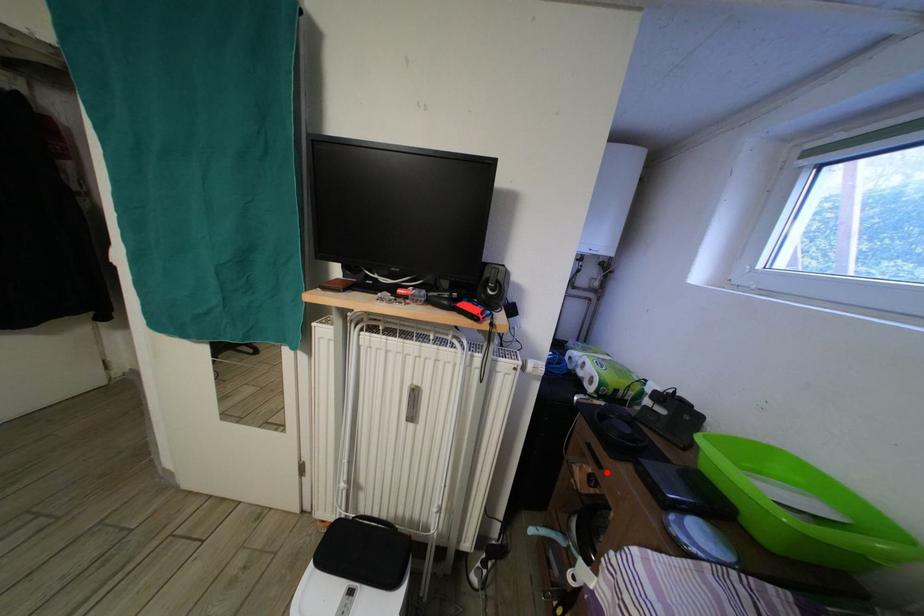
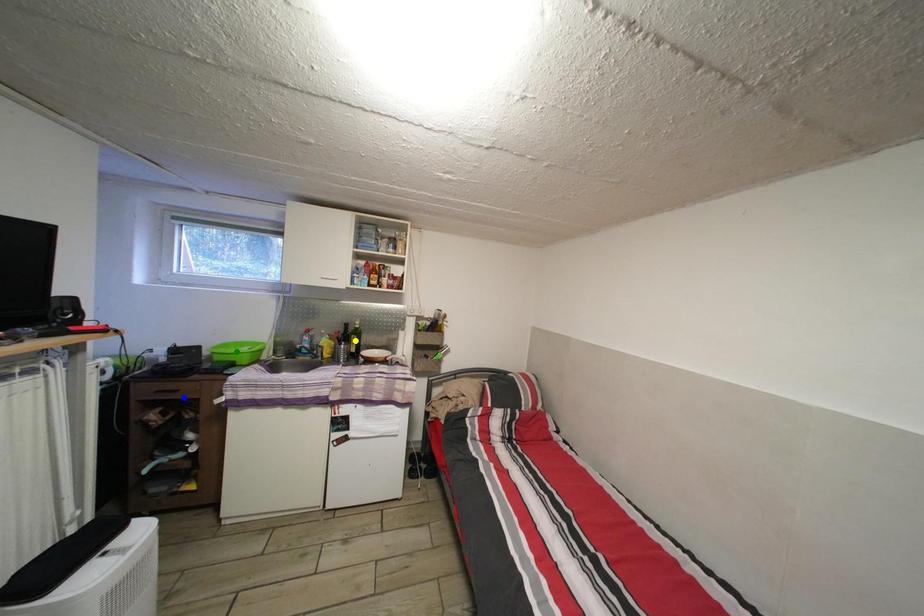
Question: I am providing you with two images of the same scene from different viewpoints. A red point is marked on the first image. You are given multiple points on the second image. Which mark in image 2 goes with the point in image 1?

Choices:
 (A) yellow point
 (B) blue point
 (C) green point

Answer: (B)